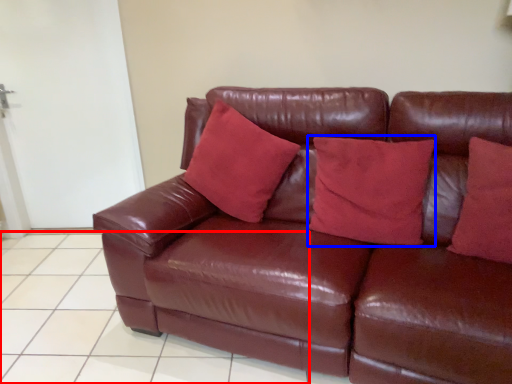
Question: Which point is closer to the camera, tile (highlighted by a red box) or pillow (highlighted by a blue box)?

Choices:
 (A) tile
 (B) pillow

Answer: (B)